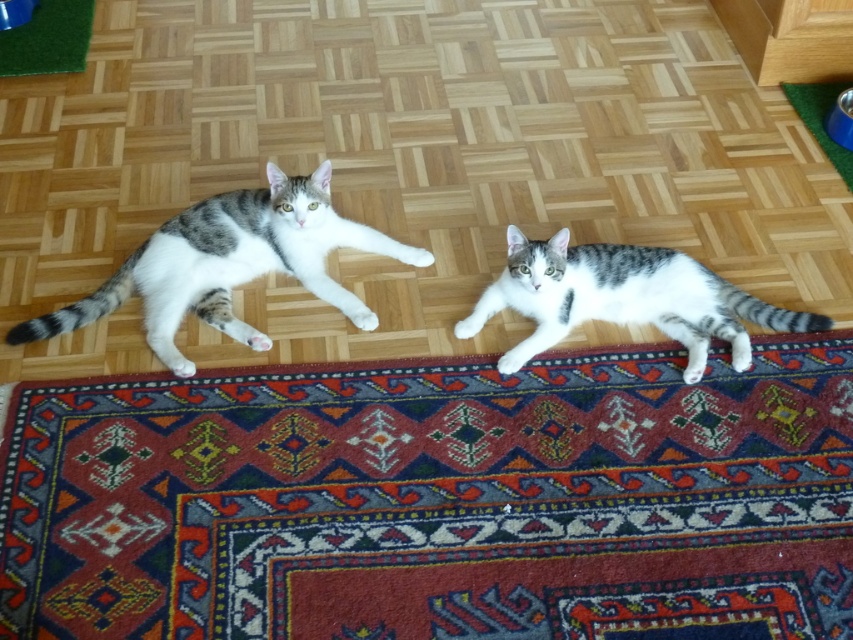
Is carpet with intricate patterns at center positioned behind white-gray fur cat at center?

That is False.

Is carpet with intricate patterns at center to the right of white-gray fur cat at center from the viewer's perspective?

In fact, carpet with intricate patterns at center is to the left of white-gray fur cat at center.

Is point (714, 572) in front of point (756, 308)?

Yes, point (714, 572) is closer to viewer.

Where is `carpet with intricate patterns at center`? carpet with intricate patterns at center is located at coordinates (438, 499).

Is white-gray fur cat at center closer to the viewer compared to green artificial turf at upper left?

Yes, white-gray fur cat at center is closer to the viewer.

Can you confirm if white-gray fur cat at center is bigger than green artificial turf at upper left?

Indeed, white-gray fur cat at center has a larger size compared to green artificial turf at upper left.

Where is `white-gray fur cat at center`? The width and height of the screenshot is (853, 640). white-gray fur cat at center is located at coordinates (624, 298).

The image size is (853, 640). Find the location of `white-gray fur cat at center`. white-gray fur cat at center is located at coordinates (624, 298).

Who is taller, carpet with intricate patterns at center or green artificial turf at upper left?

Standing taller between the two is carpet with intricate patterns at center.

Image resolution: width=853 pixels, height=640 pixels. I want to click on carpet with intricate patterns at center, so click(x=438, y=499).